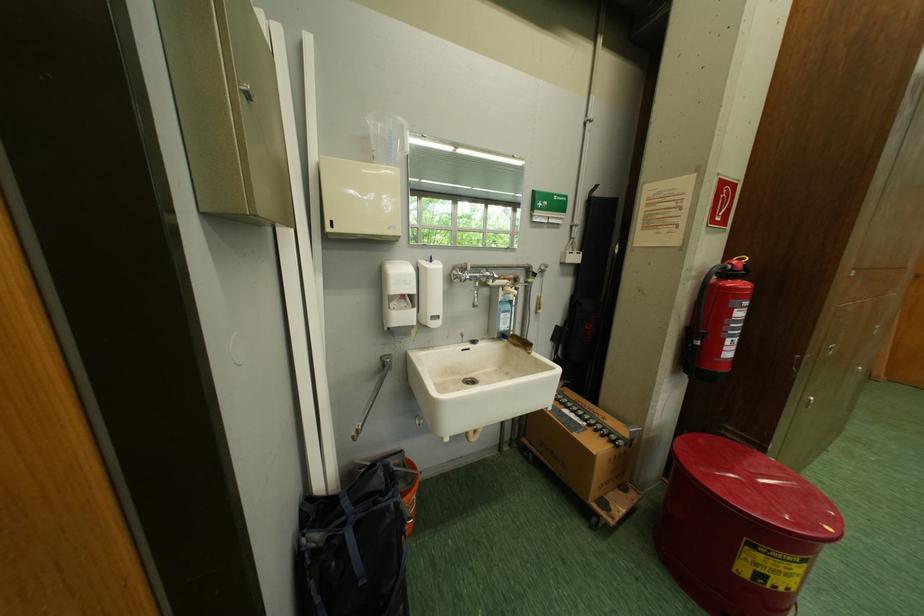
I want to click on soap dispenser pump, so click(402, 331).